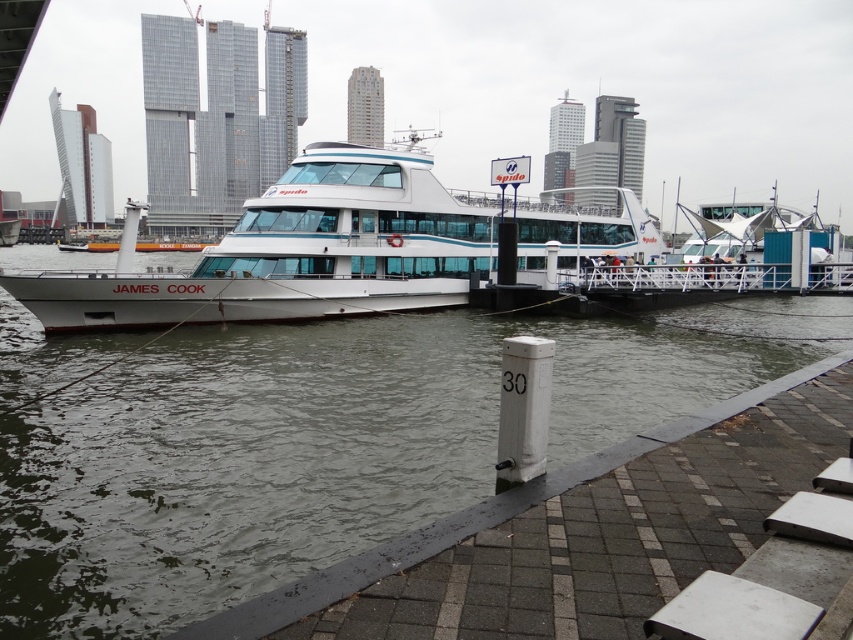
Does point (318, 397) come farther from viewer compared to point (280, 269)?

No, it is not.

Can you confirm if clear water at boat left is wider than white glossy ferry at center?

No, clear water at boat left is not wider than white glossy ferry at center.

Is point (604, 340) positioned after point (332, 273)?

That is False.

Find the location of `clear water at boat left`. clear water at boat left is located at coordinates (325, 444).